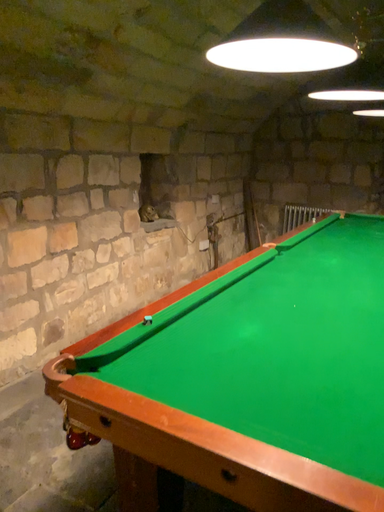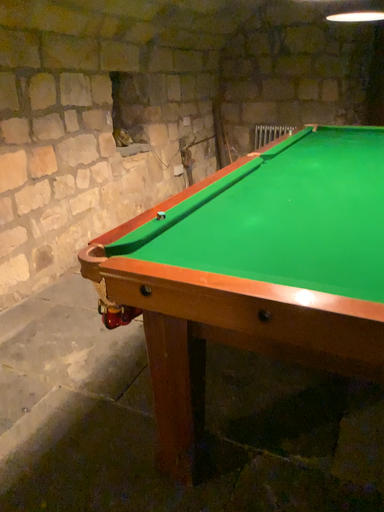
Question: How did the camera likely rotate when shooting the video?

Choices:
 (A) rotated upward
 (B) rotated downward

Answer: (B)